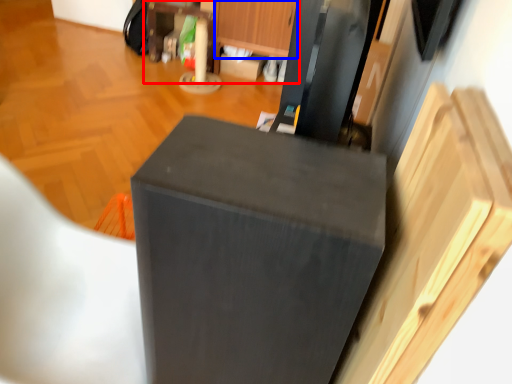
Question: Which object appears closest to the camera in this image, dresser (highlighted by a red box) or drawer (highlighted by a blue box)?

Choices:
 (A) dresser
 (B) drawer

Answer: (B)